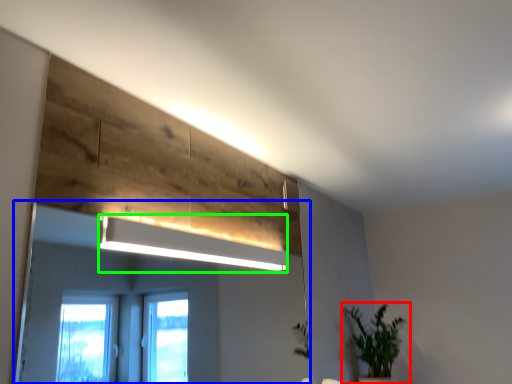
Question: Which object is positioned farthest from houseplant (highlighted by a red box)? Select from mirror (highlighted by a blue box) and lamp (highlighted by a green box).

Choices:
 (A) mirror
 (B) lamp

Answer: (A)